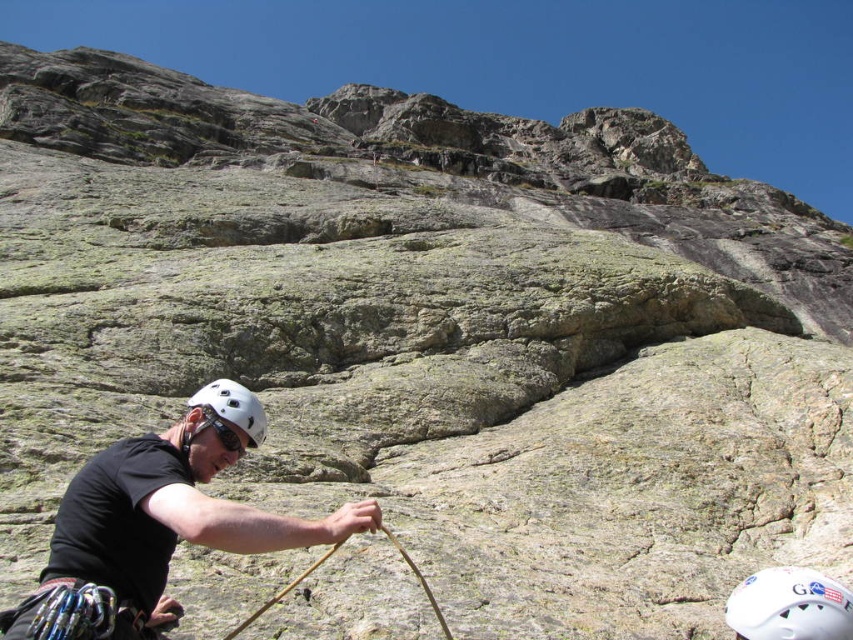
Who is shorter, white matte helmet at lower right or white matte helmet at lower left?

→ white matte helmet at lower left

Which is behind, point (759, 627) or point (227, 401)?

The point (227, 401) is behind.

In order to click on white matte helmet at lower right in this screenshot , I will do `click(788, 605)`.

Is black matte helmet at lower left thinner than white matte helmet at lower right?

No, black matte helmet at lower left is not thinner than white matte helmet at lower right.

Consider the image. Is black matte helmet at lower left positioned at the back of white matte helmet at lower right?

No, it is in front of white matte helmet at lower right.

Locate an element on the screen. The width and height of the screenshot is (853, 640). black matte helmet at lower left is located at coordinates (167, 513).

How much distance is there between black matte helmet at lower left and white matte helmet at lower left?

11.86 feet

Image resolution: width=853 pixels, height=640 pixels. Find the location of `black matte helmet at lower left`. black matte helmet at lower left is located at coordinates click(167, 513).